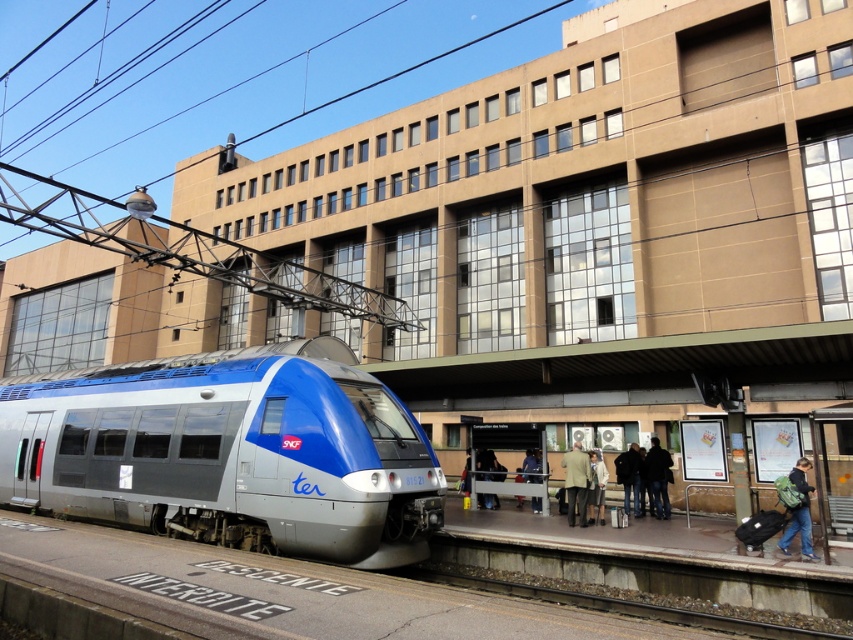
Is metallic silver coach at center wider than dark blue jacket at platform right?

Indeed, metallic silver coach at center has a greater width compared to dark blue jacket at platform right.

The width and height of the screenshot is (853, 640). In order to click on metallic silver coach at center in this screenshot , I will do `click(576, 483)`.

Between green backpack at lower right and light beige fabric coat at center, which one appears on the left side from the viewer's perspective?

Positioned to the left is light beige fabric coat at center.

Which is in front, point (788, 554) or point (589, 451)?

Positioned in front is point (788, 554).

Locate an element on the screen. This screenshot has height=640, width=853. green backpack at lower right is located at coordinates (799, 513).

Which of these two, green backpack at lower right or metallic silver coach at center, stands taller?

Standing taller between the two is metallic silver coach at center.

Between green backpack at lower right and metallic silver coach at center, which one appears on the right side from the viewer's perspective?

From the viewer's perspective, green backpack at lower right appears more on the right side.

Who is more distant from viewer, (786,548) or (567,500)?

Point (567,500)

Locate an element on the screen. green backpack at lower right is located at coordinates (799, 513).